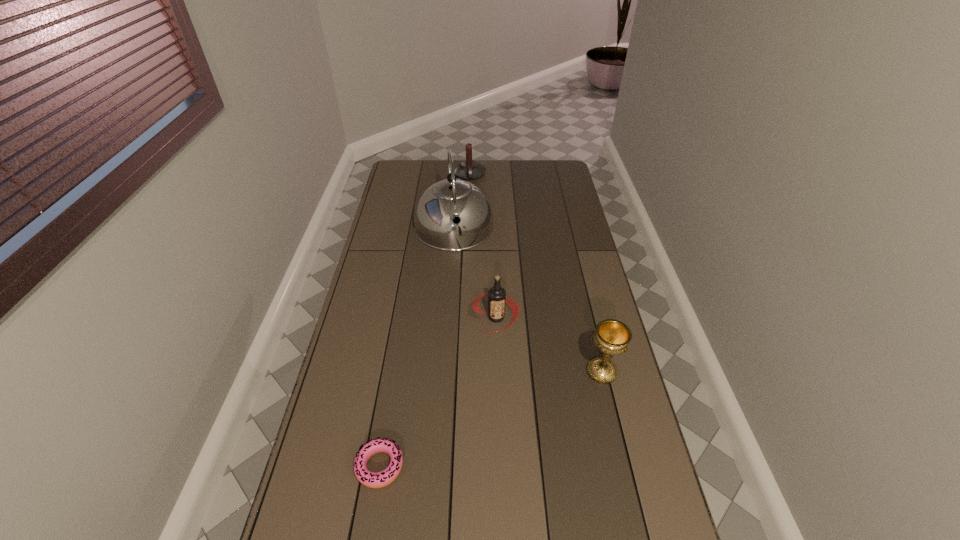
Identify the location of doughnut present at the left edge. This screenshot has width=960, height=540. (383, 478).

Where is `kettle that is at the left edge`? The height and width of the screenshot is (540, 960). kettle that is at the left edge is located at coordinates (434, 225).

Where is `object present at the right edge`? Image resolution: width=960 pixels, height=540 pixels. object present at the right edge is located at coordinates point(612,337).

Locate an element on the screen. The image size is (960, 540). free region at the far edge of the desktop is located at coordinates (512, 179).

I want to click on free location at the near edge, so click(x=583, y=518).

Find the location of a particular element. The height and width of the screenshot is (540, 960). vacant space at the left edge of the desktop is located at coordinates (406, 195).

The image size is (960, 540). I want to click on free space at the right edge of the desktop, so click(x=572, y=267).

Where is `vacant space at the far left corner of the desktop`? This screenshot has width=960, height=540. vacant space at the far left corner of the desktop is located at coordinates (402, 178).

This screenshot has width=960, height=540. Find the location of `free space between the third farthest object and the shortest object`. free space between the third farthest object and the shortest object is located at coordinates (438, 392).

Where is `unoccupied area between the nearest object and the kettle`? Image resolution: width=960 pixels, height=540 pixels. unoccupied area between the nearest object and the kettle is located at coordinates (417, 347).